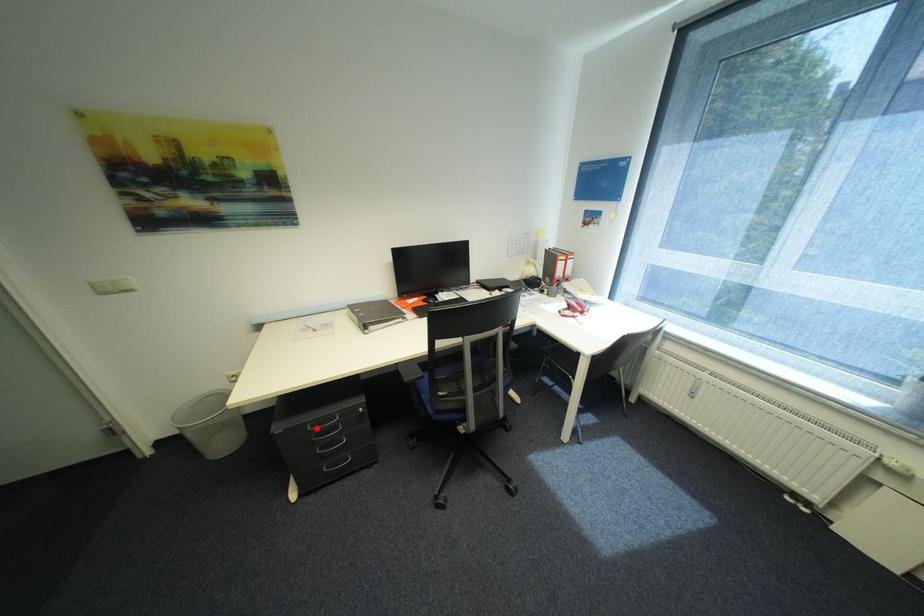
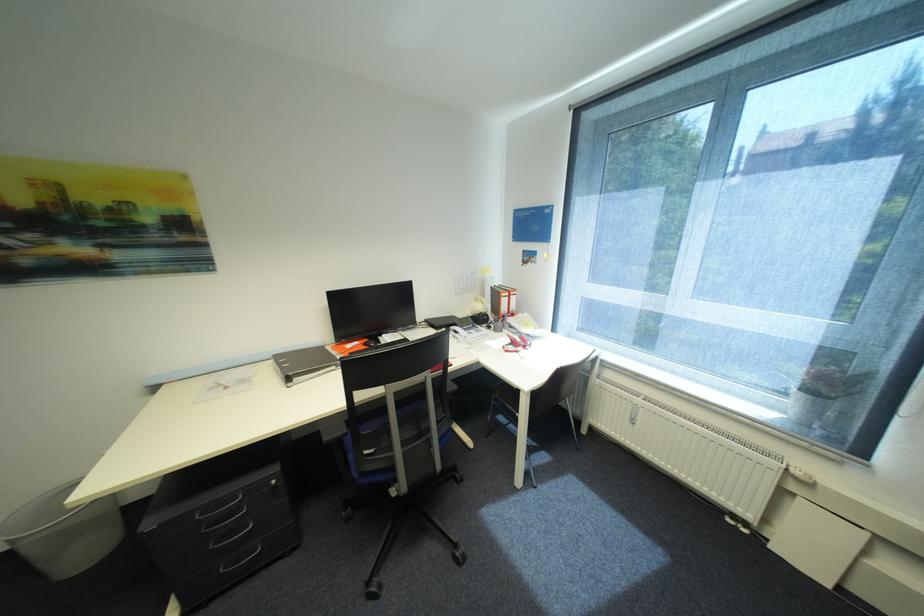
In the second image, find the point that corresponds to the highlighted location in the first image.

(205, 516)